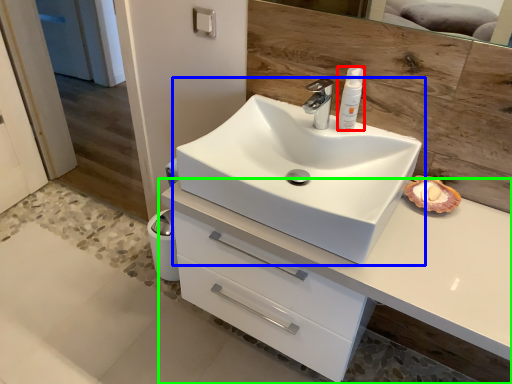
Question: Which object is positioned closest to toiletry (highlighted by a red box)? Select from sink (highlighted by a blue box) and bathroom cabinet (highlighted by a green box).

Choices:
 (A) sink
 (B) bathroom cabinet

Answer: (A)